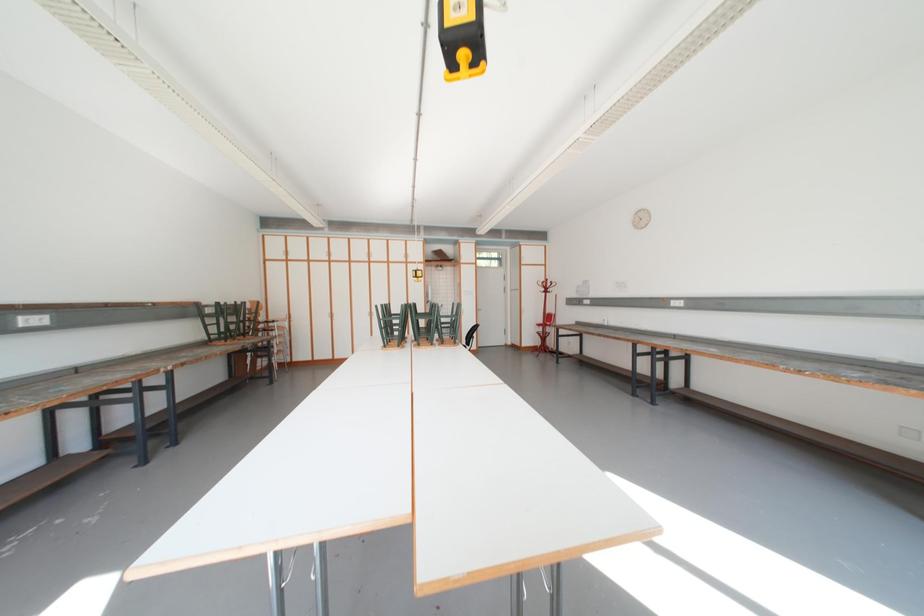
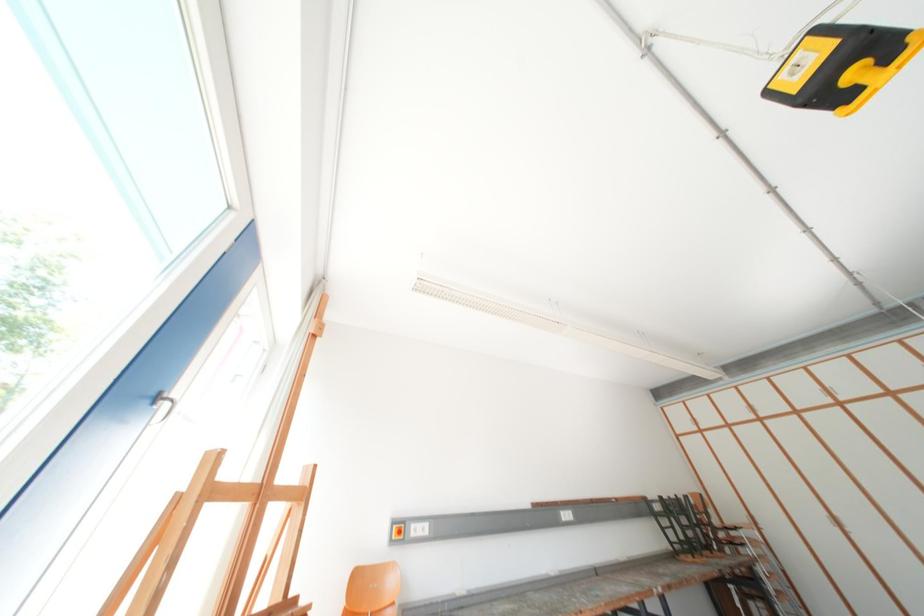
The images are taken continuously from a first-person perspective. In which direction is your viewpoint rotating?

The rotation direction of the camera is left-up.